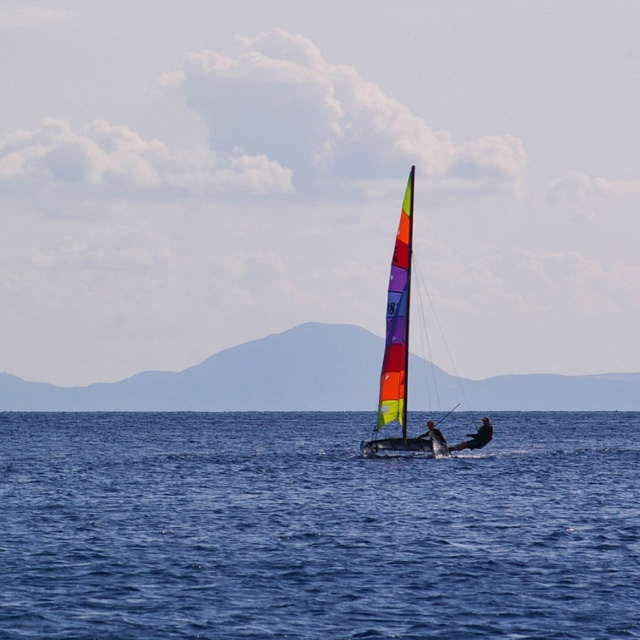
Question: Does blue water at center appear over rainbow sail sailboat at center?

Choices:
 (A) no
 (B) yes

Answer: (A)

Question: Which point appears closest to the camera in this image?

Choices:
 (A) (268, 410)
 (B) (474, 436)
 (C) (412, 452)
 (D) (456, 604)

Answer: (D)

Question: Which of the following is the farthest from the observer?

Choices:
 (A) (385, 422)
 (B) (273, 401)

Answer: (B)

Question: Is blue water at center to the right of smooth black sailboat at center from the viewer's perspective?

Choices:
 (A) yes
 (B) no

Answer: (B)

Question: Which object is the farthest from the smooth black sailboat at center?

Choices:
 (A) rainbow sail sailboat at center
 (B) blue matte horizon at center
 (C) blue water at center

Answer: (B)

Question: Does blue water at center come behind blue matte horizon at center?

Choices:
 (A) yes
 (B) no

Answer: (B)